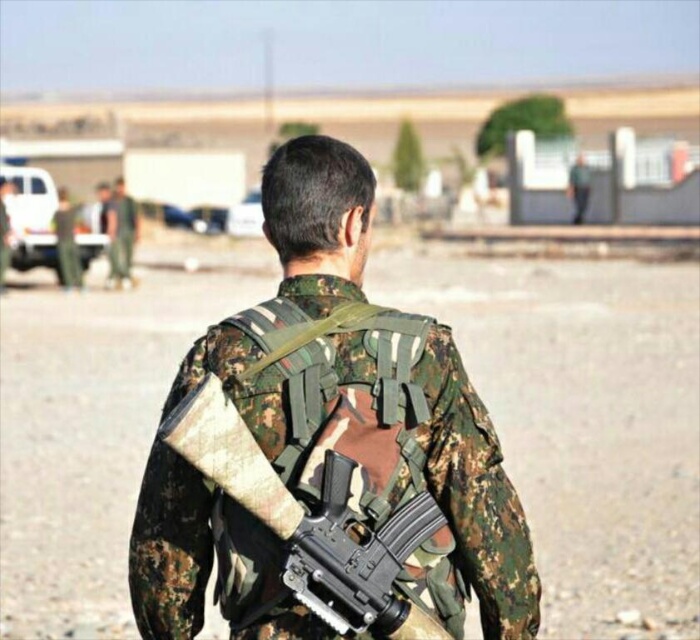
Question: Does camouflage fabric backpack at center appear under camouflage uniform at center?

Choices:
 (A) no
 (B) yes

Answer: (B)

Question: Is the position of camouflage fabric backpack at center more distant than that of camouflage fabric gun at back?

Choices:
 (A) no
 (B) yes

Answer: (B)

Question: Which point is farther from the camera taking this photo?

Choices:
 (A) click(x=116, y=209)
 (B) click(x=189, y=448)
 (C) click(x=393, y=413)

Answer: (A)

Question: Is camouflage fabric backpack at center further to camera compared to camouflage uniform at center?

Choices:
 (A) no
 (B) yes

Answer: (A)

Question: Which object is farther from the camera taking this photo?

Choices:
 (A) camouflage uniform at center
 (B) camouflage fabric gun at back
 (C) camouflage fabric backpack at center

Answer: (A)

Question: Which point is closer to the camera?

Choices:
 (A) (155, 516)
 (B) (106, 202)

Answer: (A)